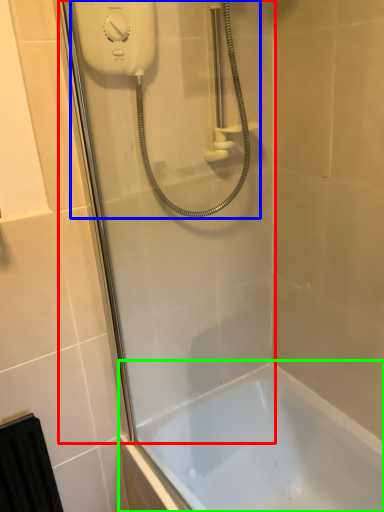
Question: Which object is the closest to the shower door (highlighted by a red box)? Choose among these: shower (highlighted by a blue box) or bathtub (highlighted by a green box).

Choices:
 (A) shower
 (B) bathtub

Answer: (A)